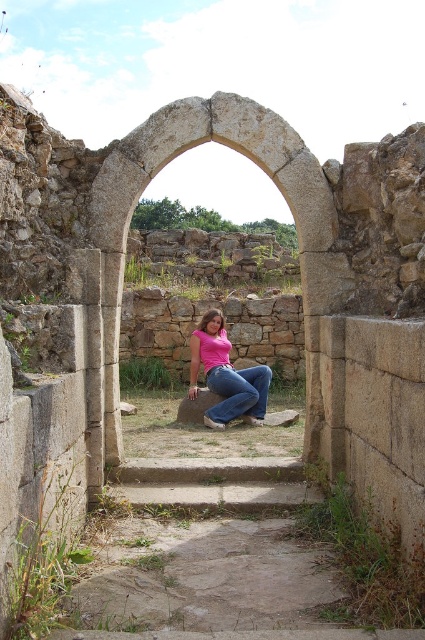
Can you confirm if pink matte shirt at center is positioned below denim jeans at center?

No, pink matte shirt at center is not below denim jeans at center.

The image size is (425, 640). Describe the element at coordinates (226, 376) in the screenshot. I see `pink matte shirt at center` at that location.

Locate an element on the screen. This screenshot has width=425, height=640. pink matte shirt at center is located at coordinates (226, 376).

Can you confirm if gray concrete stairs at center is positioned to the left of denim jeans at center?

Correct, you'll find gray concrete stairs at center to the left of denim jeans at center.

Where is `gray concrete stairs at center`? This screenshot has height=640, width=425. gray concrete stairs at center is located at coordinates (214, 483).

Does point (241, 500) lie behind point (221, 326)?

No, (241, 500) is in front of (221, 326).

Looking at this image, is gray concrete stairs at center closer to camera compared to pink matte shirt at center?

Yes, it is.

Where is `gray concrete stairs at center`? gray concrete stairs at center is located at coordinates (214, 483).